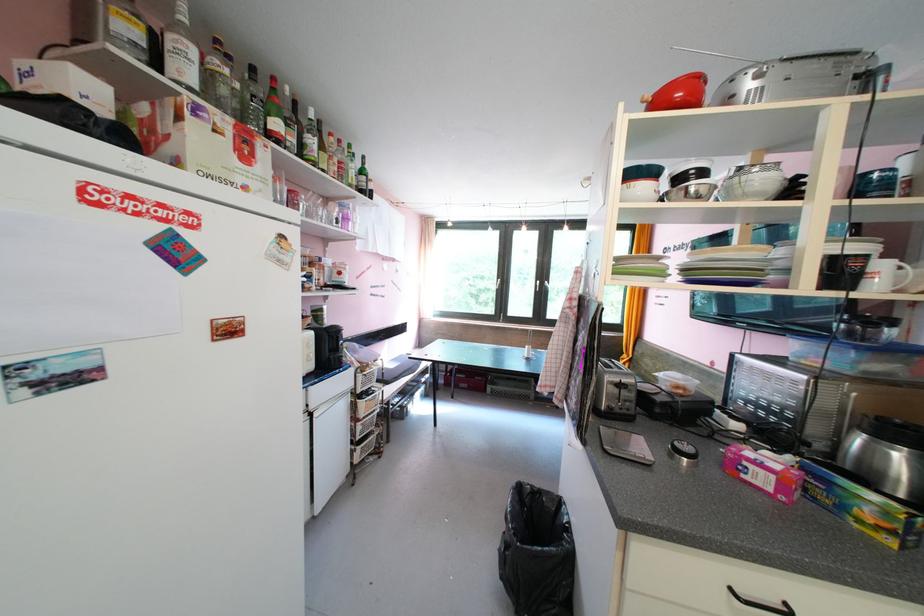
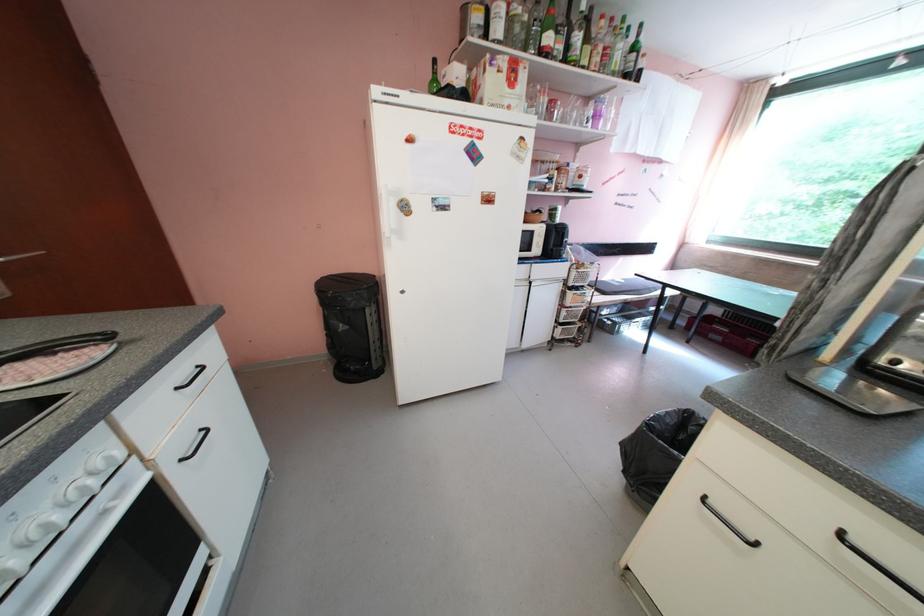
Where in the second image is the point corresponding to (x=359, y=188) from the first image?

(622, 75)